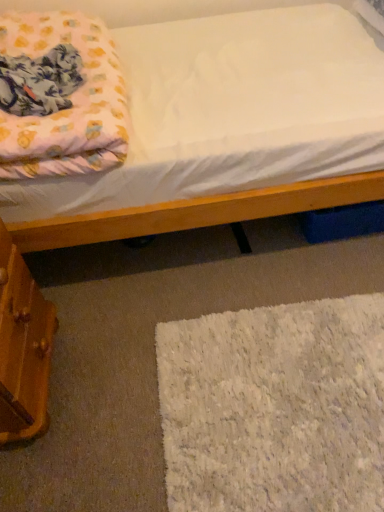
Where is `vacant location behind white fluffy rug at lower right`? vacant location behind white fluffy rug at lower right is located at coordinates (234, 270).